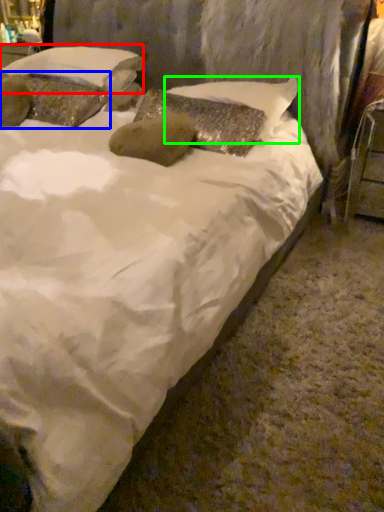
Question: Estimate the real-world distances between objects in this image. Which object is farther from pillow (highlighted by a red box), pillow (highlighted by a blue box) or pillow (highlighted by a green box)?

Choices:
 (A) pillow
 (B) pillow

Answer: (B)